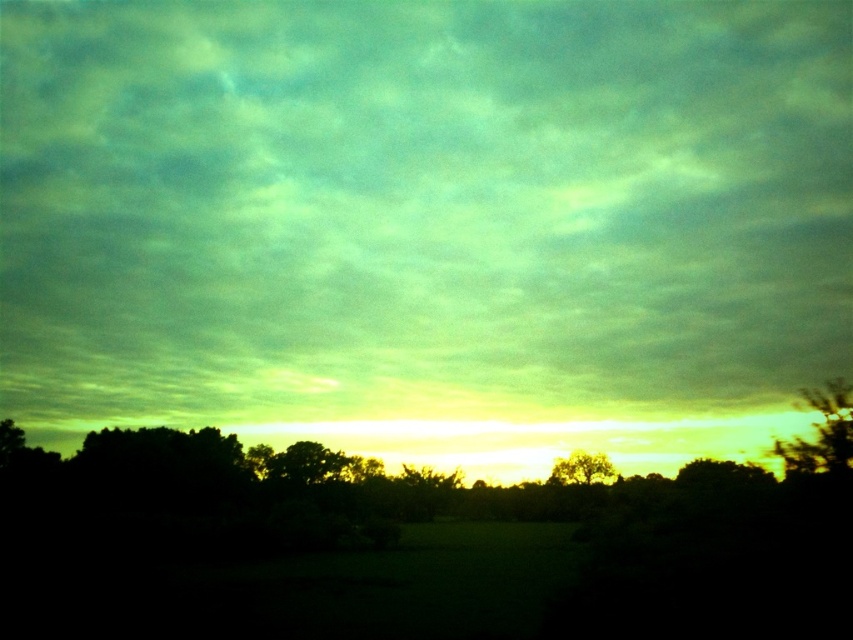
Question: Estimate the real-world distances between objects in this image. Which object is farther from the silvery metallic tree at right?

Choices:
 (A) golden textured tree at center
 (B) green matte cloud at upper center

Answer: (B)

Question: Does silvery metallic tree at right have a greater width compared to golden textured tree at center?

Choices:
 (A) yes
 (B) no

Answer: (B)

Question: Among these objects, which one is nearest to the camera?

Choices:
 (A) green matte cloud at upper center
 (B) golden textured tree at center
 (C) silvery metallic tree at right

Answer: (C)

Question: Which object appears closest to the camera in this image?

Choices:
 (A) silvery metallic tree at right
 (B) green matte cloud at upper center
 (C) golden textured tree at center

Answer: (A)

Question: Does silvery metallic tree at right have a smaller size compared to golden textured tree at center?

Choices:
 (A) no
 (B) yes

Answer: (B)

Question: Can you confirm if green matte cloud at upper center is positioned to the right of silvery metallic tree at right?

Choices:
 (A) yes
 (B) no

Answer: (B)